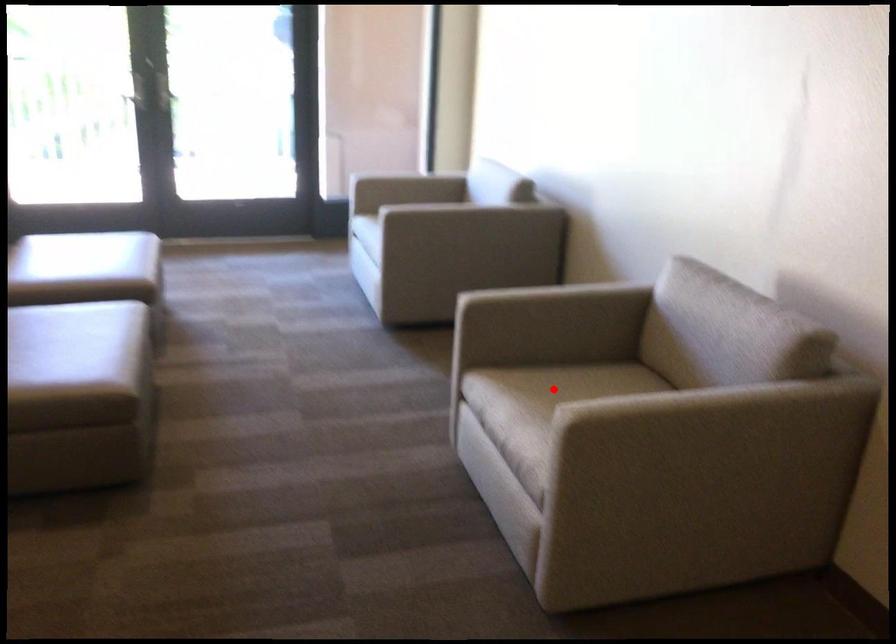
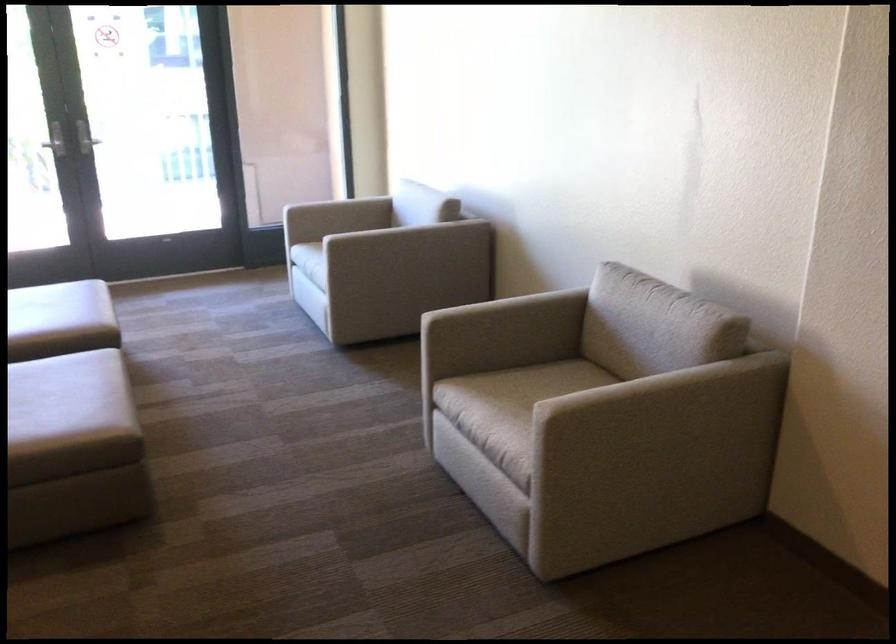
Question: I am providing you with two images of the same scene from different viewpoints. A red point is shown in image1. For the corresponding object point in image2, is it positioned nearer or farther from the camera?

Choices:
 (A) Nearer
 (B) Farther

Answer: (B)